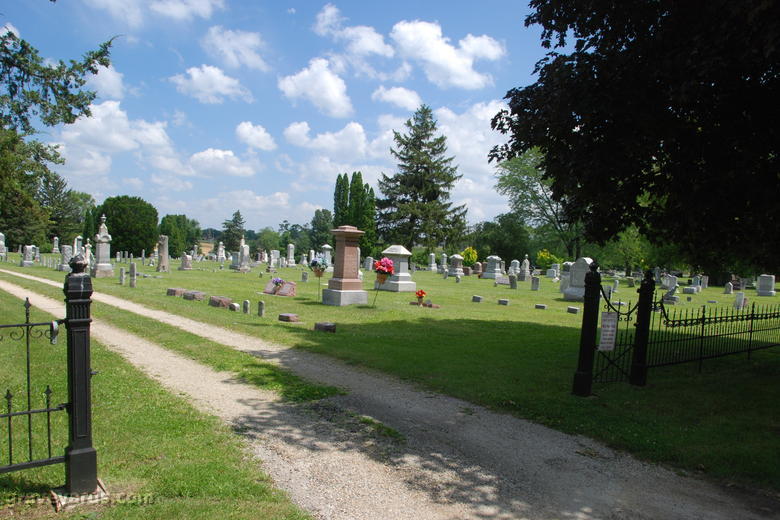
This screenshot has width=780, height=520. Identify the location of flowers on the center. (278, 281), (320, 263), (383, 267), (417, 296).